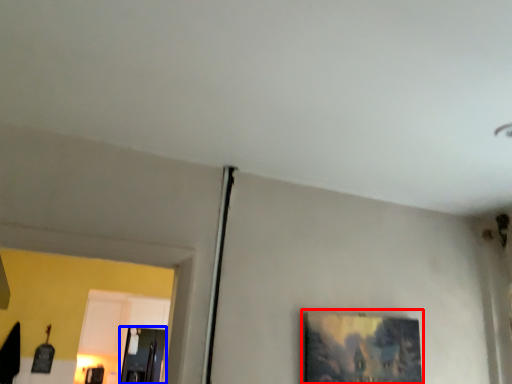
Question: Which of the following is the closest to the observer, picture frame (highlighted by a red box) or glass door (highlighted by a blue box)?

Choices:
 (A) picture frame
 (B) glass door

Answer: (A)